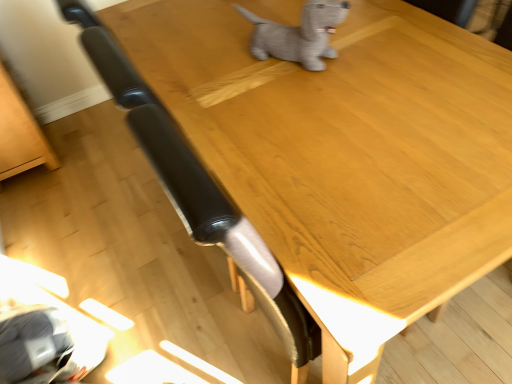
Question: Is light brown wood table at lower left taller or shorter than gray plush dog at upper center?

Choices:
 (A) tall
 (B) short

Answer: (A)

Question: From a real-world perspective, relative to gray plush dog at upper center, is light brown wood table at lower left vertically above or below?

Choices:
 (A) above
 (B) below

Answer: (B)

Question: Is light brown wood table at lower left in front of or behind gray plush dog at upper center in the image?

Choices:
 (A) behind
 (B) front

Answer: (A)

Question: Is gray plush dog at upper center in front of or behind light brown wood table at lower left in the image?

Choices:
 (A) front
 (B) behind

Answer: (A)

Question: Considering the positions of point (263, 39) and point (29, 140), is point (263, 39) closer or farther from the camera than point (29, 140)?

Choices:
 (A) farther
 (B) closer

Answer: (B)

Question: Based on their positions, is gray plush dog at upper center located to the left or right of light brown wood table at lower left?

Choices:
 (A) left
 (B) right

Answer: (B)

Question: In terms of width, does gray plush dog at upper center look wider or thinner when compared to light brown wood table at lower left?

Choices:
 (A) wide
 (B) thin

Answer: (B)